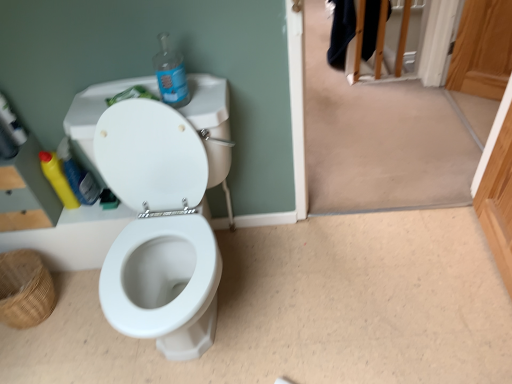
Question: Based on their sizes in the image, would you say yellow plastic bottle at left, acting as the second bottle starting from the left, is bigger or smaller than brown woven basket at lower left?

Choices:
 (A) small
 (B) big

Answer: (A)

Question: Does point (78, 173) appear closer or farther from the camera than point (7, 289)?

Choices:
 (A) closer
 (B) farther

Answer: (B)

Question: Based on their relative distances, which object is farther from the transparent plastic bottle at upper center, which is the third bottle from left to right?

Choices:
 (A) yellow plastic bottle at left, marked as the first bottle in a back-to-front arrangement
 (B) brown woven basket at lower left
 (C) yellow plastic bottle at left, the second bottle positioned from the front
 (D) white glossy toilet at center

Answer: (B)

Question: Estimate the real-world distances between objects in this image. Which object is farther from the transparent plastic bottle at upper center, which is the third bottle from left to right?

Choices:
 (A) white glossy toilet at center
 (B) yellow plastic bottle at left, which ranks as the second bottle in right-to-left order
 (C) yellow plastic bottle at left, which is the third bottle in right-to-left order
 (D) brown woven basket at lower left

Answer: (D)